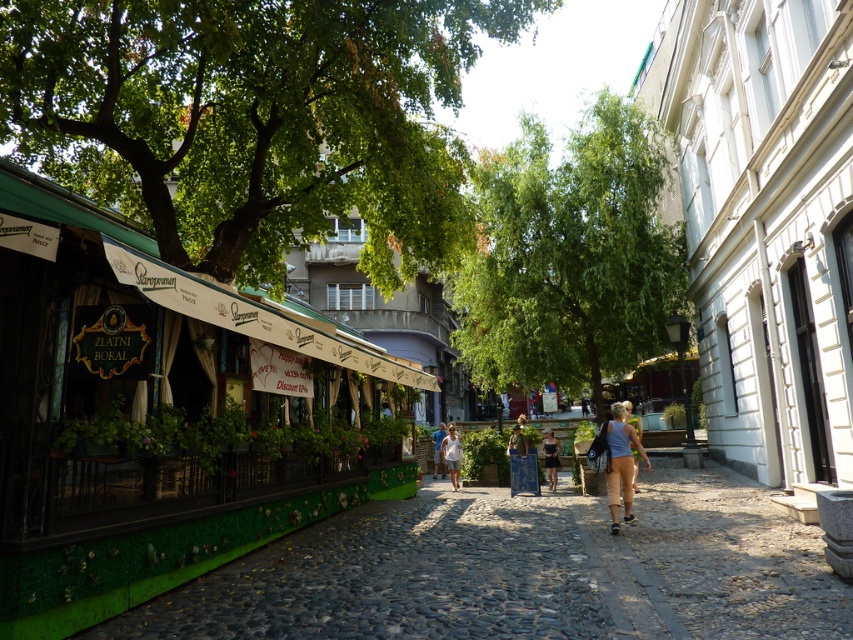
Question: Among these points, which one is farthest from the camera?

Choices:
 (A) (457, 435)
 (B) (440, 468)
 (C) (550, 445)

Answer: (B)

Question: Among these points, which one is nearest to the camera?

Choices:
 (A) (451, 442)
 (B) (102, 488)
 (C) (628, 410)

Answer: (B)

Question: Is green textured pavement at lower left thinner than green leafy tree at center?

Choices:
 (A) yes
 (B) no

Answer: (B)

Question: Is light blue denim shorts at center above white cotton dress at center?

Choices:
 (A) yes
 (B) no

Answer: (A)

Question: Which point is farther from the camera taking this photo?

Choices:
 (A) (769, 596)
 (B) (627, 410)
 (C) (552, 444)

Answer: (C)

Question: Can you confirm if green textured pavement at lower left is smaller than denim shorts at center?

Choices:
 (A) yes
 (B) no

Answer: (B)